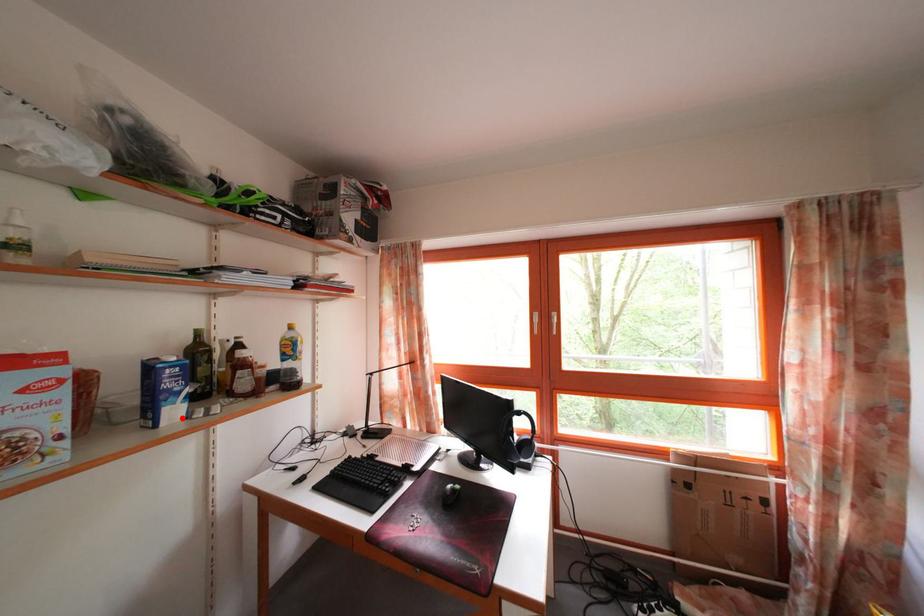
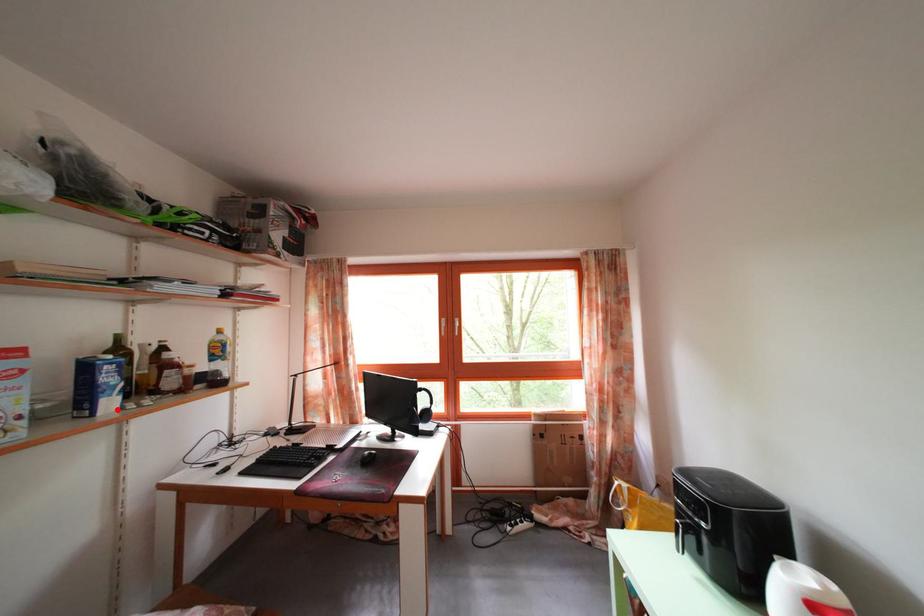
I am providing you with two images of the same scene from different viewpoints. A red point is marked on the first image and another point is marked on the second image. Does the point marked in image1 correspond to the same location as the one in image2?

Yes